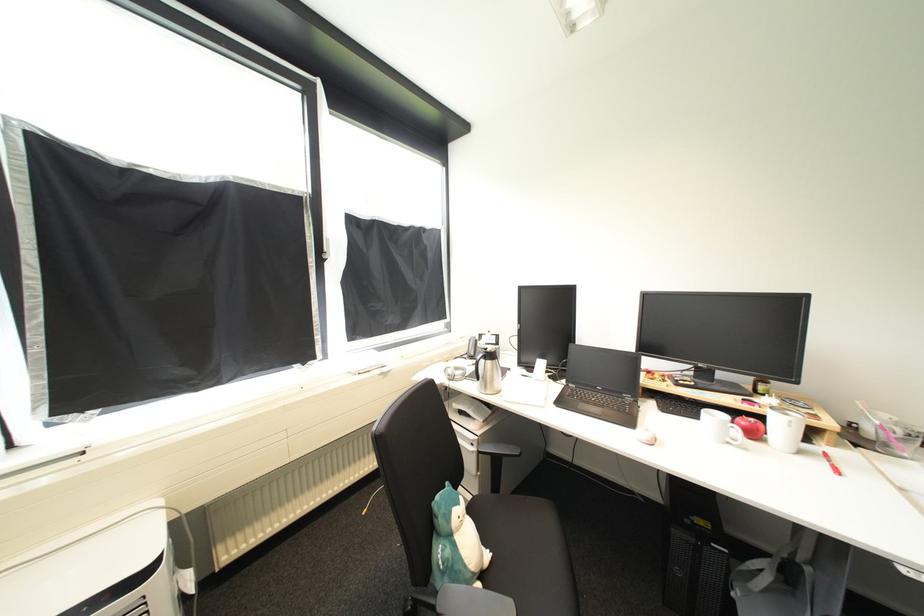
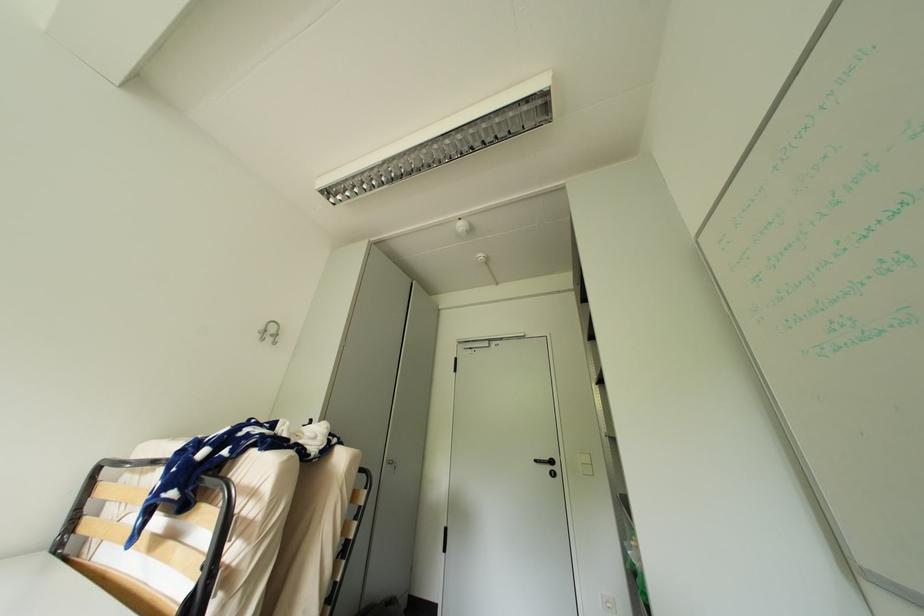
Based on the continuous images, in which direction is the camera rotating?

The camera rotated toward right-up.